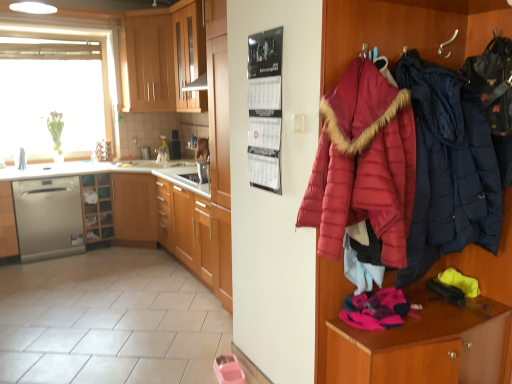
Question: Is dark blue quilted jacket at right, which is the 1th jacket in right-to-left order, located outside satin silver dishwasher at lower left?

Choices:
 (A) no
 (B) yes

Answer: (B)

Question: From a real-world perspective, is dark blue quilted jacket at right, which is the 1th jacket in right-to-left order, located beneath satin silver dishwasher at lower left?

Choices:
 (A) yes
 (B) no

Answer: (B)

Question: Is satin silver dishwasher at lower left located within dark blue quilted jacket at right, which is the 1th jacket in right-to-left order?

Choices:
 (A) no
 (B) yes

Answer: (A)

Question: Could you tell me if dark blue quilted jacket at right, which is the second jacket in left-to-right order, is turned towards satin silver dishwasher at lower left?

Choices:
 (A) yes
 (B) no

Answer: (B)

Question: From the image's perspective, is dark blue quilted jacket at right, which is the 1th jacket in right-to-left order, beneath satin silver dishwasher at lower left?

Choices:
 (A) no
 (B) yes

Answer: (A)

Question: From a real-world perspective, is dark blue quilted jacket at right, which is the second jacket in left-to-right order, above or below satin silver dishwasher at left, acting as the 1th cabinetry starting from the left?

Choices:
 (A) below
 (B) above

Answer: (B)

Question: In terms of width, does dark blue quilted jacket at right, which is the 1th jacket in right-to-left order, look wider or thinner when compared to satin silver dishwasher at left, acting as the 1th cabinetry starting from the left?

Choices:
 (A) thin
 (B) wide

Answer: (A)

Question: Does point (443, 208) appear closer or farther from the camera than point (6, 195)?

Choices:
 (A) closer
 (B) farther

Answer: (A)

Question: Choose the correct answer: Is dark blue quilted jacket at right, which is the second jacket in left-to-right order, inside satin silver dishwasher at left, acting as the 1th cabinetry starting from the left, or outside it?

Choices:
 (A) inside
 (B) outside

Answer: (B)

Question: From the image's perspective, relative to wooden cabinet at upper center, the 3th cabinetry in the left-to-right sequence, is dark blue quilted jacket at right, which is the second jacket in left-to-right order, above or below?

Choices:
 (A) below
 (B) above

Answer: (A)

Question: Based on their sizes in the image, would you say dark blue quilted jacket at right, which is the second jacket in left-to-right order, is bigger or smaller than wooden cabinet at upper center, acting as the 2th cabinetry starting from the right?

Choices:
 (A) small
 (B) big

Answer: (A)

Question: Visually, is dark blue quilted jacket at right, which is the second jacket in left-to-right order, positioned to the left or to the right of wooden cabinet at upper center, the 3th cabinetry in the left-to-right sequence?

Choices:
 (A) left
 (B) right

Answer: (B)

Question: Is dark blue quilted jacket at right, which is the 1th jacket in right-to-left order, wider or thinner than wooden cabinet at upper center, the 3th cabinetry in the left-to-right sequence?

Choices:
 (A) wide
 (B) thin

Answer: (B)

Question: Based on their positions, is wooden cabinet at upper center, the second cabinetry when ordered from left to right, located to the left or right of wooden shelves at lower left?

Choices:
 (A) right
 (B) left

Answer: (A)

Question: Is wooden cabinet at upper center, the second cabinetry when ordered from left to right, in front of or behind wooden shelves at lower left in the image?

Choices:
 (A) front
 (B) behind

Answer: (A)